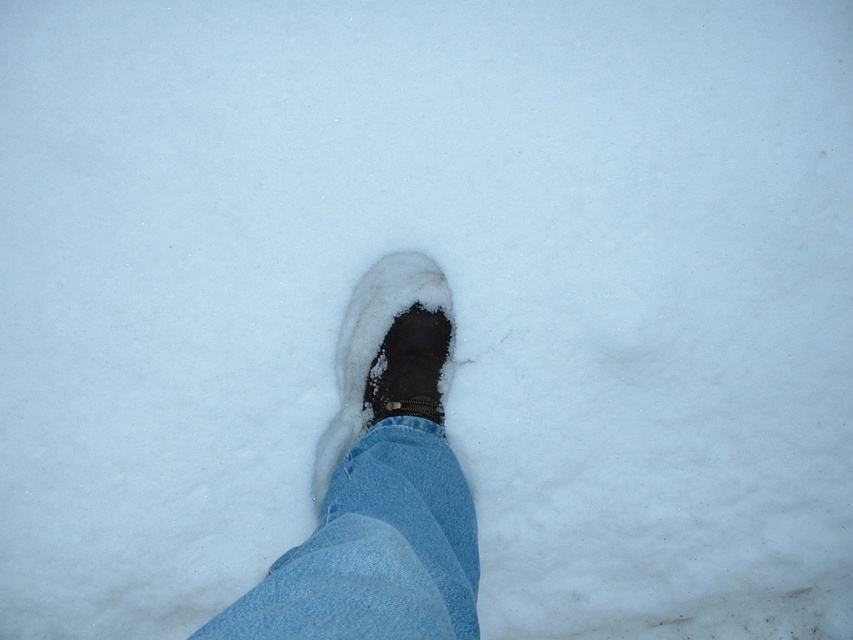
You are trying to determine which item is taller between the denim at center and the brown suede boot at center in the snowy scene. Based on the description, which one is taller?

The brown suede boot at center is taller than denim at center.

You are standing in a snowy area and see the denim at center and the brown suede boot at center. Which object is closer to you?

The denim at center is closer to the viewer than the brown suede boot at center.

You are standing in a snowy area and see your denim at center and brown suede boot at center. Which item is positioned more to the left?

The brown suede boot at center is positioned more to the left than the denim at center.